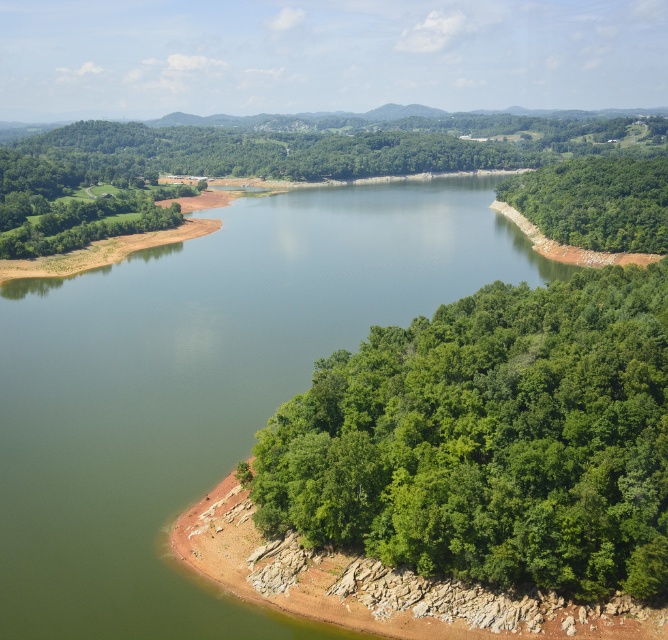
From the picture: You are standing at the edge of the green leafy forest at lower right and want to reach the green smooth water at center. In which direction should you head to get there?

You should head to the left to reach the green smooth water at center since it is located to the left of the green leafy forest at lower right.